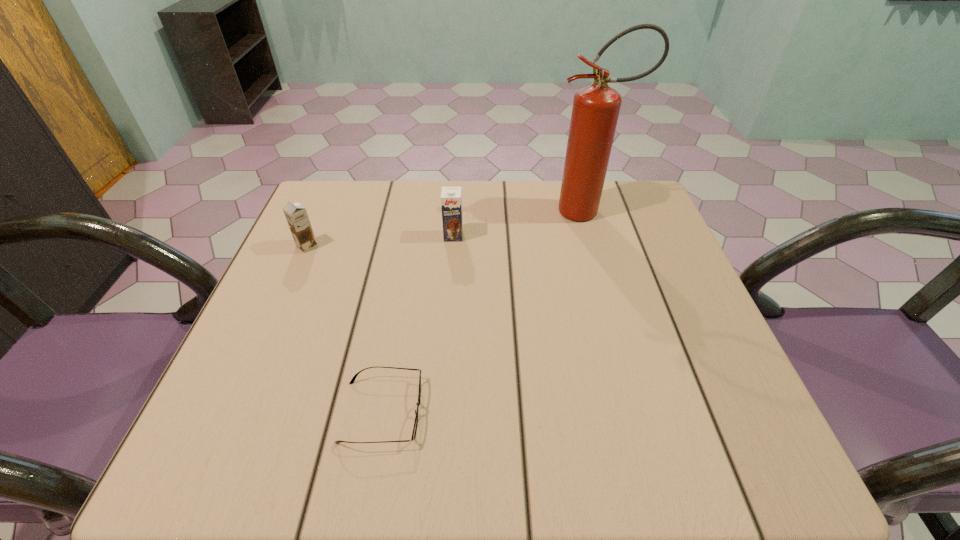
Where is `the rightmost object`? The height and width of the screenshot is (540, 960). the rightmost object is located at coordinates [595, 111].

What are the coordinates of `fire extinguisher` in the screenshot? It's located at (595, 111).

Identify the location of the second object from right to left. This screenshot has width=960, height=540. (451, 199).

Where is `the leftmost object`? Image resolution: width=960 pixels, height=540 pixels. the leftmost object is located at coordinates (296, 215).

This screenshot has width=960, height=540. I want to click on spectacles, so click(353, 379).

Locate an element on the screen. This screenshot has height=540, width=960. the nearest object is located at coordinates (353, 379).

I want to click on vacant space located 0.340m from the nozzle of the tallest object, so click(x=421, y=211).

The height and width of the screenshot is (540, 960). What are the coordinates of `vacant region located 0.380m from the nozzle of the tallest object` in the screenshot? It's located at (407, 211).

You are a GUI agent. You are given a task and a screenshot of the screen. Output one action in this format:
    pyautogui.click(x=<x>, y=<y>)
    Task: Click on the vacant point located from the nozzle of the tallest object
    The image size is (960, 540).
    Given the screenshot: What is the action you would take?
    pyautogui.click(x=456, y=211)

What are the coordinates of `free spot located 0.280m on the front label of the right chocolate milk` in the screenshot? It's located at (446, 331).